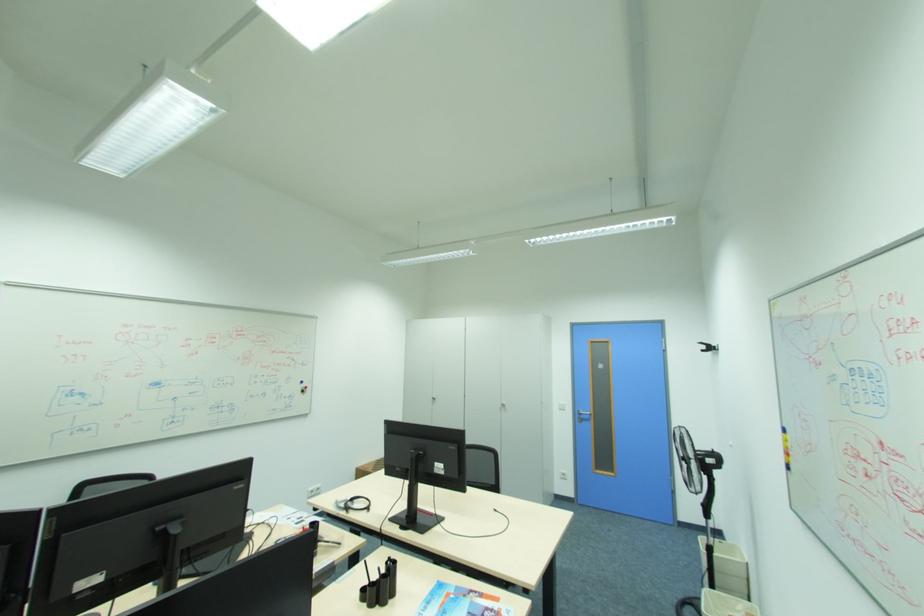
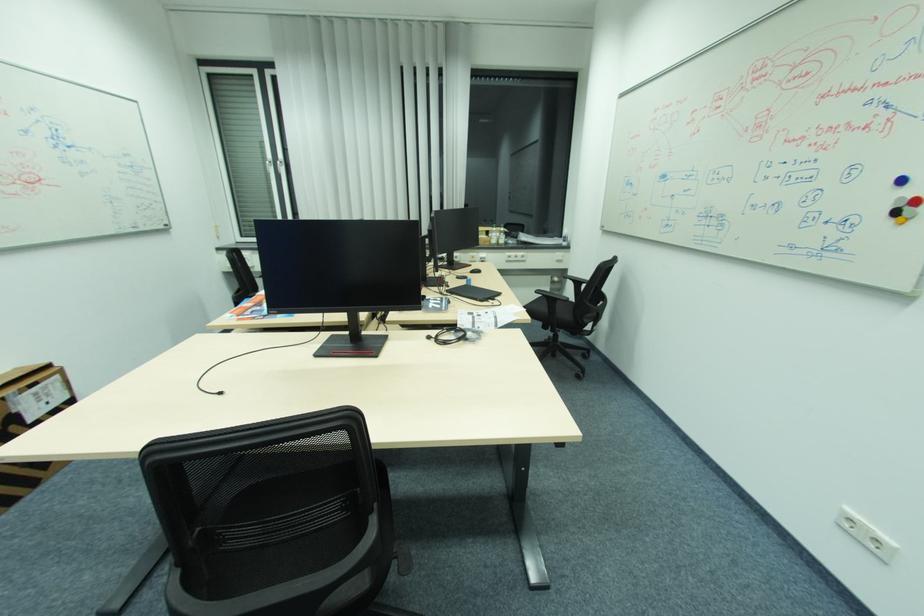
Locate, in the second image, the point that corresponds to (309,389) in the first image.

(907, 206)